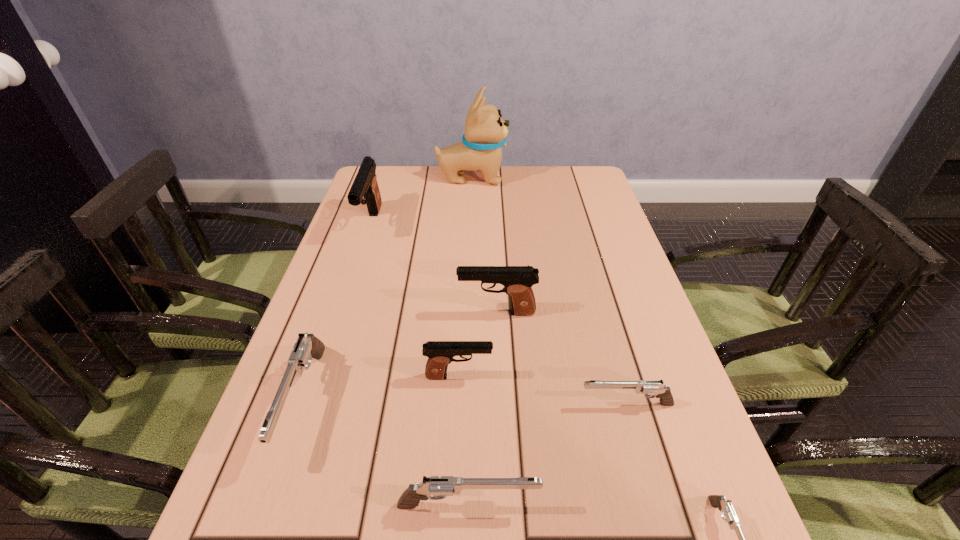
Identify the location of the fourth closest silver pistol to the second smallest black pistol. The image size is (960, 540). (727, 510).

Identify which silver pistol is located as the second nearest to the shortest pistol. Please provide its 2D coordinates. Your answer should be formatted as a tuple, i.e. [(x, y)], where the tuple contains the x and y coordinates of a point satisfying the conditions above.

[(435, 487)]

The image size is (960, 540). In order to click on free location that satisfies the following two spatial constraints: 1. on the face of the puppy; 2. at the barrel of the seventh shortest object in this screenshot , I will do `click(470, 224)`.